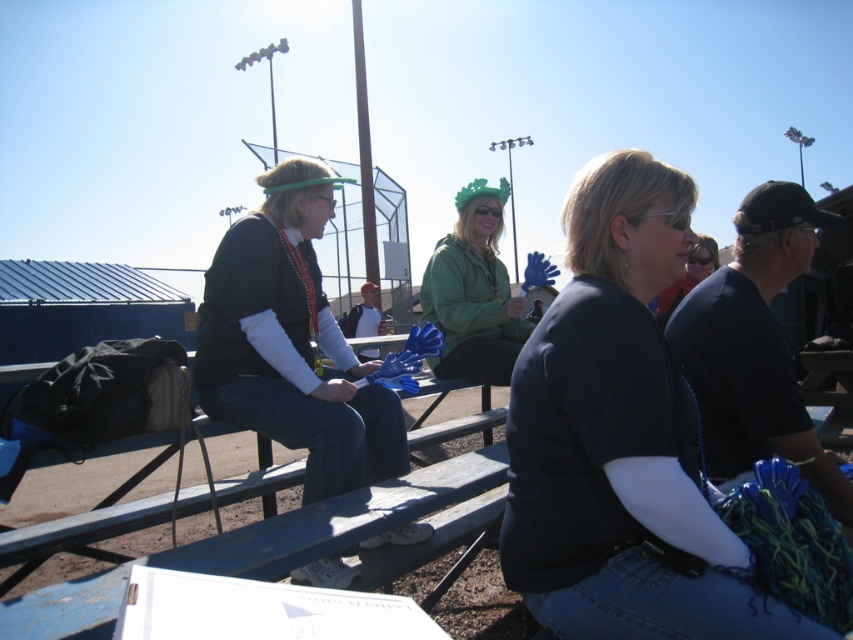
Between matte black jacket at left and green matte jacket at center, which one is positioned lower?

Positioned lower is matte black jacket at left.

Can you confirm if matte black jacket at left is smaller than green matte jacket at center?

No.

Between point (396, 396) and point (502, 189), which one is positioned behind?

The point (502, 189) is more distant.

Locate an element on the screen. The image size is (853, 640). matte black jacket at left is located at coordinates (292, 342).

Is dark blue jersey at center to the left of green matte jacket at center from the viewer's perspective?

No, dark blue jersey at center is not to the left of green matte jacket at center.

Does dark blue jersey at center appear under green matte jacket at center?

Indeed, dark blue jersey at center is positioned under green matte jacket at center.

Find the location of `dark blue jersey at center`. dark blue jersey at center is located at coordinates (621, 440).

Who is lower down, dark blue jersey at center or matte black jacket at left?

A: Positioned lower is dark blue jersey at center.

Is dark blue jersey at center to the left of matte black jacket at left from the viewer's perspective?

In fact, dark blue jersey at center is to the right of matte black jacket at left.

Is point (527, 339) positioned after point (349, 445)?

No, it is not.

The height and width of the screenshot is (640, 853). In order to click on dark blue jersey at center in this screenshot , I will do `click(621, 440)`.